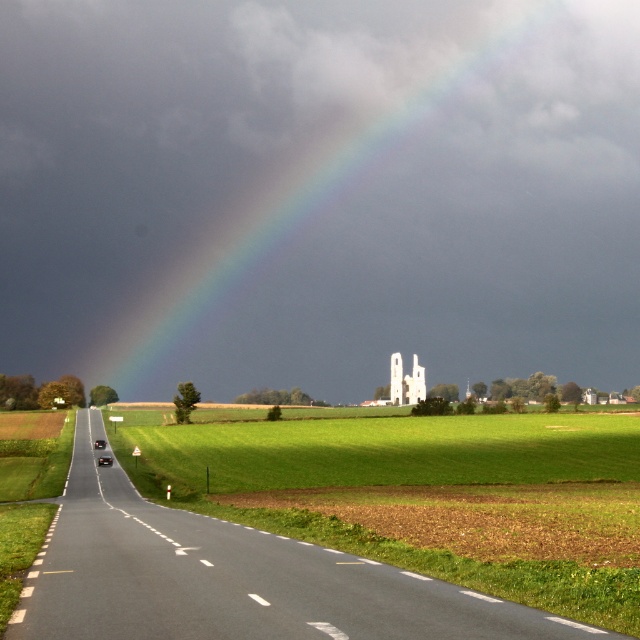
Is rainbow at upper center thinner than shiny black sedan at road center?

No.

Is rainbow at upper center shorter than shiny black sedan at road center?

No.

Is point (83, 64) positioned after point (100, 445)?

Yes, it is behind point (100, 445).

This screenshot has width=640, height=640. Find the location of `rainbow at upper center`. rainbow at upper center is located at coordinates (323, 193).

Who is more distant from viewer, (x=321, y=17) or (x=109, y=458)?

The point (x=321, y=17) is behind.

Can you confirm if rainbow at upper center is positioned to the left of black glossy car at center?

Incorrect, rainbow at upper center is not on the left side of black glossy car at center.

What are the coordinates of `rainbow at upper center` in the screenshot? It's located at (323, 193).

Does black glossy car at center appear under shiny black sedan at road center?

No.

Where is `black glossy car at center`? This screenshot has width=640, height=640. black glossy car at center is located at coordinates (104, 460).

Is point (108, 464) in front of point (97, 444)?

Yes, point (108, 464) is closer to viewer.

Identify the location of black glossy car at center. The height and width of the screenshot is (640, 640). (104, 460).